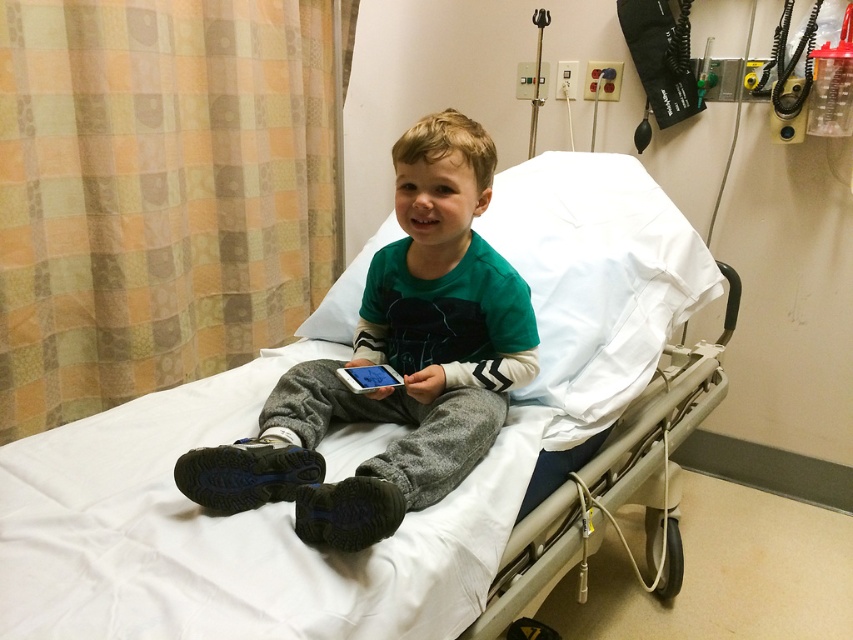
Between white fabric hospital bed at center and white glossy phone at center, which one is positioned higher?

white fabric hospital bed at center is above.

Which is behind, point (113, 440) or point (364, 365)?

The point (364, 365) is more distant.

Find the location of `white fabric hospital bed at center`. white fabric hospital bed at center is located at coordinates (289, 506).

You are a GUI agent. You are given a task and a screenshot of the screen. Output one action in this format:
    pyautogui.click(x=<x>, y=<y>)
    Task: Click on the white fabric hospital bed at center
    This screenshot has height=640, width=853.
    Given the screenshot: What is the action you would take?
    pyautogui.click(x=289, y=506)

Does white fabric hospital bed at center have a greater height compared to green cotton shirt at center?

Indeed, white fabric hospital bed at center has a greater height compared to green cotton shirt at center.

Is point (283, 596) positioned in front of point (373, 292)?

That is True.

Is point (650, 365) positioned behind point (421, 316)?

Yes.

Where is `white fabric hospital bed at center`? white fabric hospital bed at center is located at coordinates (289, 506).

Does green cotton shirt at center have a lesser width compared to white glossy phone at center?

No, green cotton shirt at center is not thinner than white glossy phone at center.

Can you confirm if green cotton shirt at center is taller than white glossy phone at center?

Yes, green cotton shirt at center is taller than white glossy phone at center.

What do you see at coordinates (396, 362) in the screenshot? I see `green cotton shirt at center` at bounding box center [396, 362].

Locate an element on the screen. green cotton shirt at center is located at coordinates (396, 362).